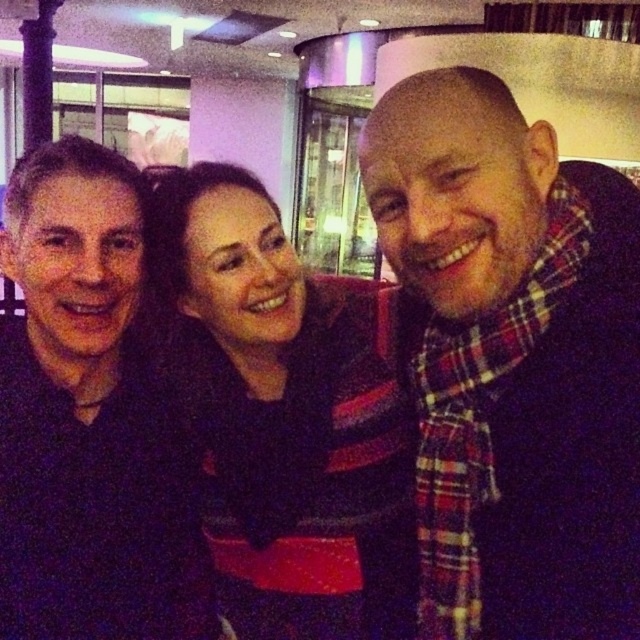
Question: Which object appears closest to the camera in this image?

Choices:
 (A) black knitwear at center
 (B) plaid scarf at right
 (C) dark blue shirt at left

Answer: (B)

Question: Among these points, which one is nearest to the camera?

Choices:
 (A) (612, 582)
 (B) (124, 540)
 (C) (333, 349)

Answer: (A)

Question: Can you confirm if black knitwear at center is thinner than dark blue shirt at left?

Choices:
 (A) no
 (B) yes

Answer: (A)

Question: Does black knitwear at center have a larger size compared to dark blue shirt at left?

Choices:
 (A) yes
 (B) no

Answer: (B)

Question: Which object is the closest to the dark blue shirt at left?

Choices:
 (A) black knitwear at center
 (B) plaid scarf at right

Answer: (A)

Question: Can you confirm if black knitwear at center is positioned to the left of dark blue shirt at left?

Choices:
 (A) yes
 (B) no

Answer: (B)